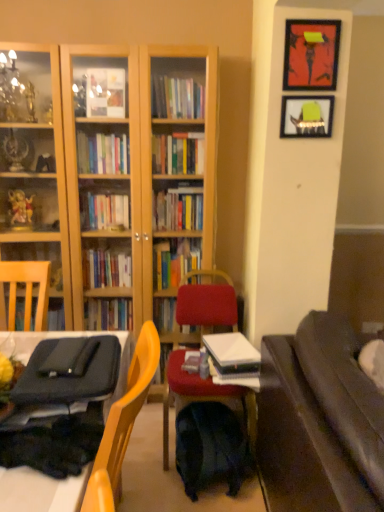
Question: Is metallic framed artwork at upper right, marked as the second picture frame in a bottom-to-top arrangement, taller or shorter than matte green picture frame at upper right, arranged as the second picture frame when viewed from the top?

Choices:
 (A) tall
 (B) short

Answer: (A)

Question: Do you think metallic framed artwork at upper right, arranged as the first picture frame when viewed from the top, is within matte green picture frame at upper right, arranged as the second picture frame when viewed from the top, or outside of it?

Choices:
 (A) outside
 (B) inside

Answer: (A)

Question: Which of these objects is positioned closest to the metallic framed artwork at upper right, marked as the second picture frame in a bottom-to-top arrangement?

Choices:
 (A) matte black laptop at left
 (B) velvet red chair at center
 (C) matte green picture frame at upper right, which is the first picture frame from bottom to top
 (D) white paper stack at center
 (E) dark brown leather couch at right

Answer: (C)

Question: Based on their relative distances, which object is farther from the dark blue fabric backpack at center?

Choices:
 (A) matte green picture frame at upper right, which is the first picture frame from bottom to top
 (B) matte black laptop at left
 (C) metallic framed artwork at upper right, marked as the second picture frame in a bottom-to-top arrangement
 (D) white paper stack at center
 (E) dark brown leather couch at right

Answer: (C)